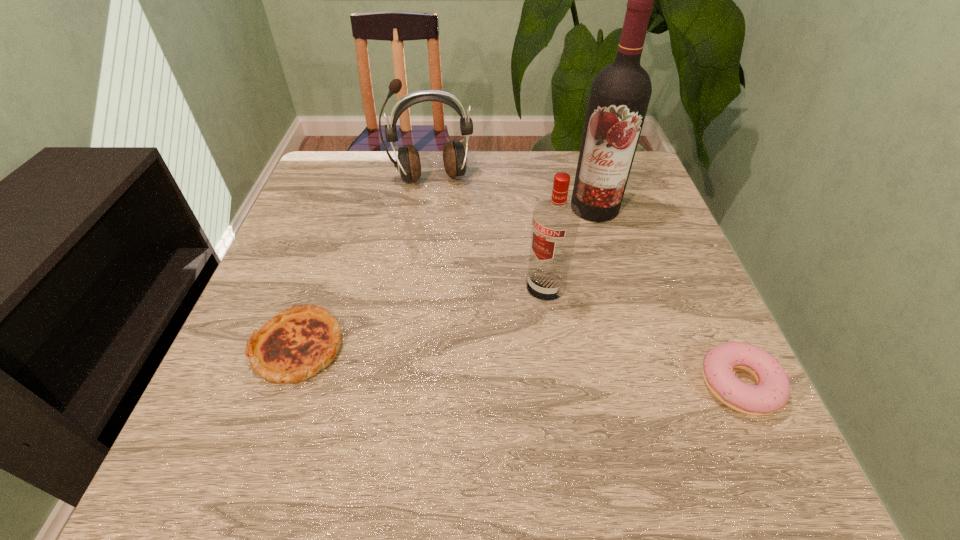
At what (x,y) coordinates should I click in order to perform the action: click on free space located 0.340m on the right of the quiche. Please return your answer as a coordinate pair (x, y). Looking at the image, I should click on (523, 347).

The width and height of the screenshot is (960, 540). I want to click on free space located on the back of the rightmost object, so click(675, 245).

Where is `blank space located on the ear pads of the earphone`? blank space located on the ear pads of the earphone is located at coordinates (441, 207).

Where is `vacant space located on the ear pads of the earphone`? The image size is (960, 540). vacant space located on the ear pads of the earphone is located at coordinates (453, 269).

Where is `blank space located 0.270m on the ear pads of the earphone`? The image size is (960, 540). blank space located 0.270m on the ear pads of the earphone is located at coordinates (451, 260).

In order to click on vacant area situated 0.380m on the label of the second farthest object in this screenshot , I will do `click(514, 325)`.

Find the location of a particular element. This screenshot has width=960, height=540. vacant space located on the label of the second farthest object is located at coordinates (534, 296).

Locate an element on the screen. The height and width of the screenshot is (540, 960). free spot located on the label of the second farthest object is located at coordinates (512, 329).

Image resolution: width=960 pixels, height=540 pixels. Identify the location of vacant space located 0.060m on the front label of the vodka. (516, 316).

Find the location of a particular element. The width and height of the screenshot is (960, 540). blank area located 0.280m on the front label of the vodka is located at coordinates (438, 390).